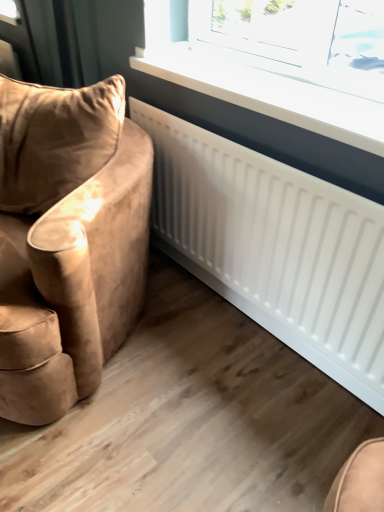
Locate an element on the screen. The image size is (384, 512). white glossy radiator at upper center is located at coordinates (285, 64).

This screenshot has height=512, width=384. What do you see at coordinates (285, 64) in the screenshot?
I see `white glossy radiator at upper center` at bounding box center [285, 64].

This screenshot has width=384, height=512. I want to click on suede-like brown armchair at left, so click(68, 241).

What is the approximate height of suede-like brown armchair at left?

suede-like brown armchair at left is 34.42 inches in height.

The image size is (384, 512). Describe the element at coordinates (68, 241) in the screenshot. I see `suede-like brown armchair at left` at that location.

The height and width of the screenshot is (512, 384). In order to click on white glossy radiator at upper center in this screenshot , I will do tap(285, 64).

Which is more to the left, white glossy radiator at upper center or suede-like brown armchair at left?

suede-like brown armchair at left.

Which object is closer to the camera taking this photo, white glossy radiator at upper center or suede-like brown armchair at left?

suede-like brown armchair at left is closer to the camera.

Which point is more distant from viewer, (324, 131) or (68, 194)?

The point (68, 194) is farther.

From the image's perspective, which one is positioned lower, white glossy radiator at upper center or suede-like brown armchair at left?

From the image's view, suede-like brown armchair at left is below.

From a real-world perspective, between white glossy radiator at upper center and suede-like brown armchair at left, who is vertically higher?

white glossy radiator at upper center, from a real-world perspective.

Between white glossy radiator at upper center and suede-like brown armchair at left, which one has smaller width?

Thinner between the two is white glossy radiator at upper center.

Is white glossy radiator at upper center shorter than suede-like brown armchair at left?

Yes.

Considering the relative sizes of white glossy radiator at upper center and suede-like brown armchair at left in the image provided, is white glossy radiator at upper center bigger than suede-like brown armchair at left?

No, white glossy radiator at upper center is not bigger than suede-like brown armchair at left.

Is suede-like brown armchair at left completely or partially inside white glossy radiator at upper center?

That's incorrect, suede-like brown armchair at left is not inside white glossy radiator at upper center.

In the scene shown: Are white glossy radiator at upper center and suede-like brown armchair at left located far from each other?

white glossy radiator at upper center is actually quite close to suede-like brown armchair at left.

Does white glossy radiator at upper center turn towards suede-like brown armchair at left?

Yes, white glossy radiator at upper center is oriented towards suede-like brown armchair at left.

Can you tell me how much white glossy radiator at upper center and suede-like brown armchair at left differ in facing direction?

The facing directions of white glossy radiator at upper center and suede-like brown armchair at left are 22.2 degrees apart.

At what (x,y) coordinates should I click in order to perform the action: click on window above the suede-like brown armchair at left (from a real-world perspective). Please return your answer as a coordinate pair (x, y). Image resolution: width=384 pixels, height=512 pixels. Looking at the image, I should click on (285, 64).

Can you confirm if suede-like brown armchair at left is positioned to the left of white glossy radiator at upper center?

Yes, suede-like brown armchair at left is to the left of white glossy radiator at upper center.

Is suede-like brown armchair at left positioned before white glossy radiator at upper center?

Yes, the depth of suede-like brown armchair at left is less than that of white glossy radiator at upper center.

Is point (105, 82) closer to viewer compared to point (261, 79)?

Yes, it is.

From the image's perspective, which is below, suede-like brown armchair at left or white glossy radiator at upper center?

From the image's view, suede-like brown armchair at left is below.

From a real-world perspective, is suede-like brown armchair at left on white glossy radiator at upper center?

No.

Considering the sizes of suede-like brown armchair at left and white glossy radiator at upper center in the image, is suede-like brown armchair at left wider or thinner than white glossy radiator at upper center?

In the image, suede-like brown armchair at left appears to be wider than white glossy radiator at upper center.

Can you confirm if suede-like brown armchair at left is taller than white glossy radiator at upper center?

Indeed, suede-like brown armchair at left has a greater height compared to white glossy radiator at upper center.

Considering the relative sizes of suede-like brown armchair at left and white glossy radiator at upper center in the image provided, is suede-like brown armchair at left smaller than white glossy radiator at upper center?

Actually, suede-like brown armchair at left might be larger than white glossy radiator at upper center.

Do you think suede-like brown armchair at left is within white glossy radiator at upper center, or outside of it?

suede-like brown armchair at left is outside white glossy radiator at upper center.

From the picture: Is suede-like brown armchair at left next to white glossy radiator at upper center and touching it?

suede-like brown armchair at left and white glossy radiator at upper center are not in contact.

Based on the photo, is suede-like brown armchair at left aimed at white glossy radiator at upper center?

No, suede-like brown armchair at left is not turned towards white glossy radiator at upper center.

I want to click on window behind the suede-like brown armchair at left, so tap(285, 64).

In the image, there is a white glossy radiator at upper center. At what (x,y) coordinates should I click in order to perform the action: click on chair below it (from the image's perspective). Please return your answer as a coordinate pair (x, y). The height and width of the screenshot is (512, 384). Looking at the image, I should click on (68, 241).

Image resolution: width=384 pixels, height=512 pixels. Find the location of `window behind the suede-like brown armchair at left`. window behind the suede-like brown armchair at left is located at coordinates (285, 64).